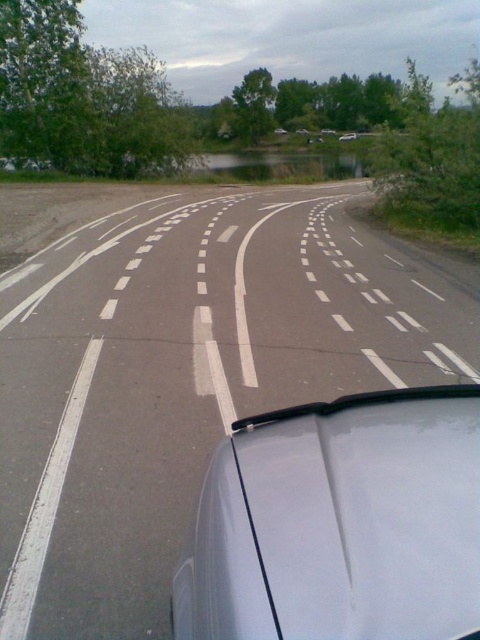
Between white asphalt road at center and satin white car at center, which one is positioned lower?

satin white car at center is lower down.

Does white asphalt road at center come in front of satin white car at center?

No, white asphalt road at center is further to the viewer.

Is point (336, 259) positioned after point (414, 468)?

Yes, it is.

I want to click on white asphalt road at center, so [x=183, y=372].

Does point (444, 401) come behind point (344, 134)?

No, (444, 401) is closer to viewer.

Which is more to the left, satin white car at center or white glossy car at center?

From the viewer's perspective, satin white car at center appears more on the left side.

Identify the location of satin white car at center. Image resolution: width=480 pixels, height=640 pixels. (339, 522).

Is white asphalt road at center behind white glossy car at center?

No, it is not.

Can you confirm if white asphalt road at center is wider than white glossy car at center?

Yes.

Measure the distance between point (165, 536) and camera.

Point (165, 536) and camera are 3.22 meters apart from each other.

Find the location of a particular element. Image resolution: width=480 pixels, height=640 pixels. white asphalt road at center is located at coordinates (183, 372).